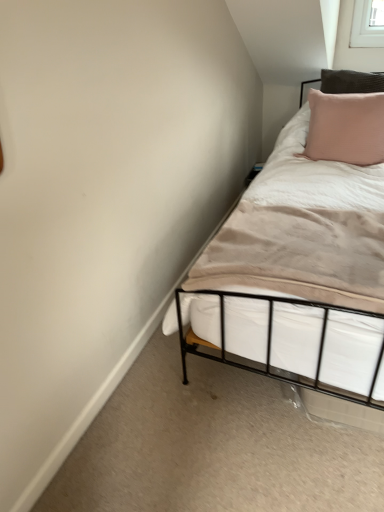
Question: From the image's perspective, is white soft fabric mattress at center beneath pink textured pillow at upper right?

Choices:
 (A) yes
 (B) no

Answer: (A)

Question: Is white soft fabric mattress at center next to pink textured pillow at upper right?

Choices:
 (A) yes
 (B) no

Answer: (B)

Question: Considering the relative positions of white soft fabric mattress at center and pink textured pillow at upper right in the image provided, is white soft fabric mattress at center to the left of pink textured pillow at upper right from the viewer's perspective?

Choices:
 (A) yes
 (B) no

Answer: (A)

Question: Does white soft fabric mattress at center have a lesser height compared to pink textured pillow at upper right?

Choices:
 (A) yes
 (B) no

Answer: (A)

Question: Is white soft fabric mattress at center further to camera compared to pink textured pillow at upper right?

Choices:
 (A) no
 (B) yes

Answer: (A)

Question: From a real-world perspective, is white soft fabric mattress at center positioned under pink textured pillow at upper right based on gravity?

Choices:
 (A) yes
 (B) no

Answer: (A)

Question: Is pink textured pillow at upper right taller than white soft fabric mattress at center?

Choices:
 (A) no
 (B) yes

Answer: (B)

Question: Is there a large distance between pink textured pillow at upper right and white soft fabric mattress at center?

Choices:
 (A) yes
 (B) no

Answer: (B)

Question: Does pink textured pillow at upper right have a smaller size compared to white soft fabric mattress at center?

Choices:
 (A) yes
 (B) no

Answer: (B)

Question: Is pink textured pillow at upper right to the right of white soft fabric mattress at center from the viewer's perspective?

Choices:
 (A) no
 (B) yes

Answer: (B)

Question: Is the depth of pink textured pillow at upper right greater than that of white soft fabric mattress at center?

Choices:
 (A) yes
 (B) no

Answer: (A)

Question: Can you see pink textured pillow at upper right touching white soft fabric mattress at center?

Choices:
 (A) no
 (B) yes

Answer: (A)

Question: Relative to pink textured pillow at upper right, is white soft fabric mattress at center in front or behind?

Choices:
 (A) behind
 (B) front

Answer: (B)